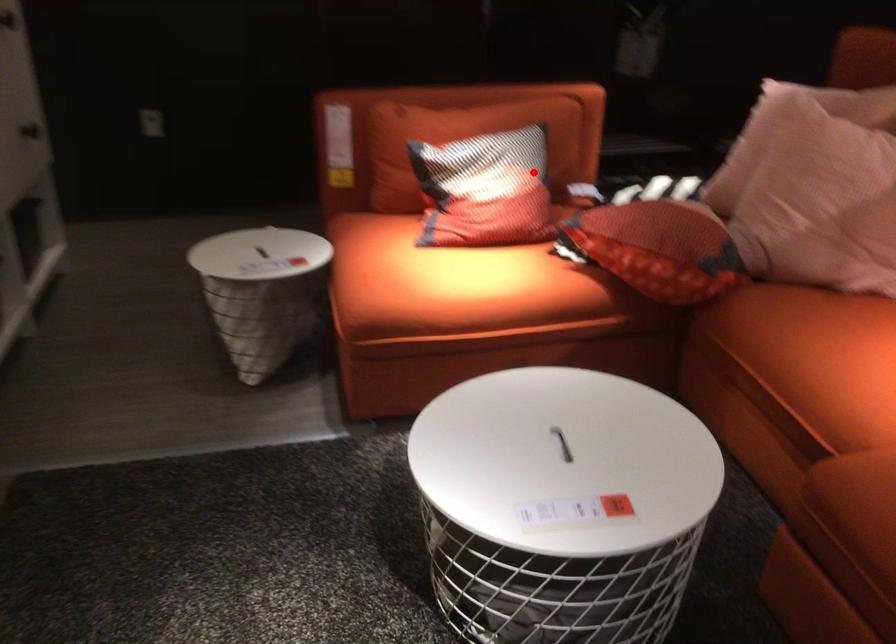
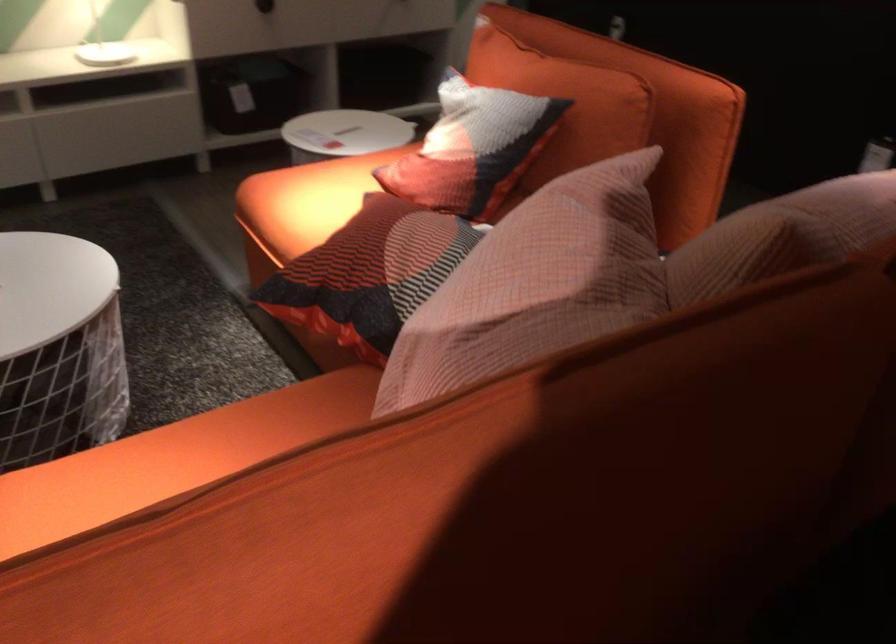
Find the pixel in the second image that matches the highlighted location in the first image.

(472, 147)